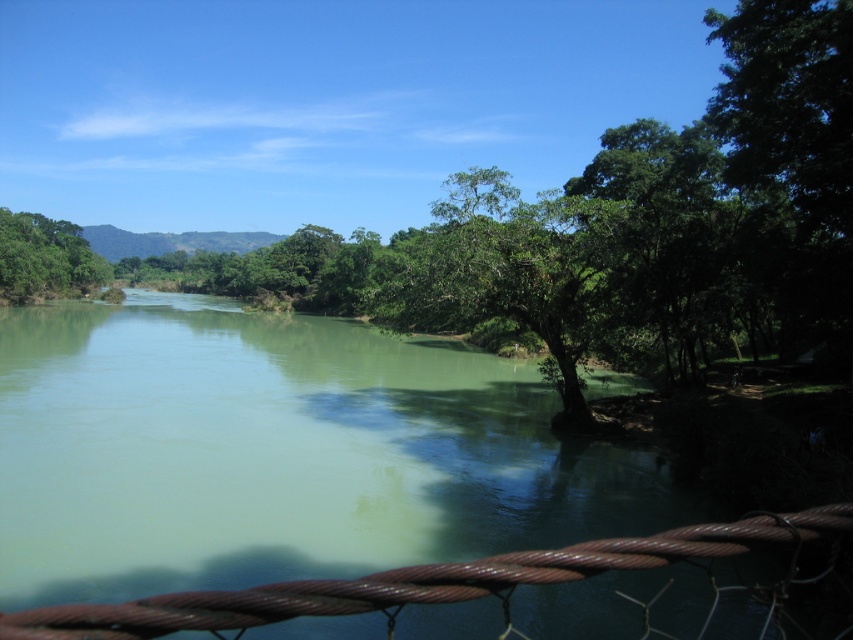
Question: Which of the following is the farthest from the observer?

Choices:
 (A) (4, 211)
 (B) (503, 241)
 (C) (514, 563)

Answer: (A)

Question: Does green leafy tree at center appear on the left side of green leafy tree at upper left?

Choices:
 (A) yes
 (B) no

Answer: (B)

Question: Which object is the farthest from the rusty wire rope at lower center?

Choices:
 (A) green leafy tree at center
 (B) green leafy tree at upper left

Answer: (B)

Question: Can you confirm if green leafy tree at center is bigger than green leafy tree at upper left?

Choices:
 (A) no
 (B) yes

Answer: (A)

Question: Which object is closer to the camera taking this photo?

Choices:
 (A) green leafy tree at upper left
 (B) green leafy tree at center

Answer: (B)

Question: Is the position of green leafy tree at center less distant than that of green leafy tree at upper left?

Choices:
 (A) no
 (B) yes

Answer: (B)